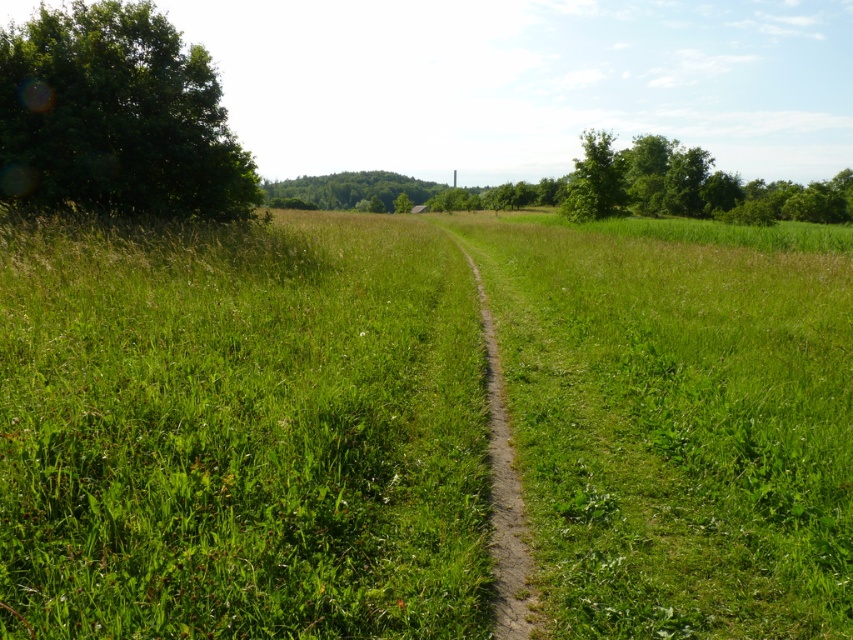
Question: Does green leafy tree at left have a greater width compared to green leafy tree at center?

Choices:
 (A) no
 (B) yes

Answer: (A)

Question: Which of the following is the farthest from the observer?

Choices:
 (A) (206, 330)
 (B) (490, 340)

Answer: (B)

Question: Which of the following is the farthest from the observer?

Choices:
 (A) (323, 445)
 (B) (701, 157)
 (C) (177, 125)

Answer: (B)

Question: Which point is farther from the camera taking this photo?

Choices:
 (A) (614, 164)
 (B) (125, 4)
 (C) (573, 212)
 (D) (711, 432)

Answer: (C)

Question: Is green leafy tree at left above green leafy tree at center?

Choices:
 (A) no
 (B) yes

Answer: (A)

Question: Does dirt path at center have a larger size compared to green leafy tree at upper right?

Choices:
 (A) yes
 (B) no

Answer: (B)